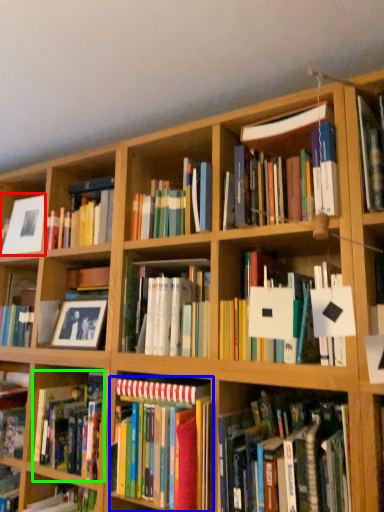
Question: Estimate the real-world distances between objects in this image. Which object is closer to picture frame (highlighted by a red box), book (highlighted by a blue box) or book (highlighted by a green box)?

Choices:
 (A) book
 (B) book

Answer: (B)